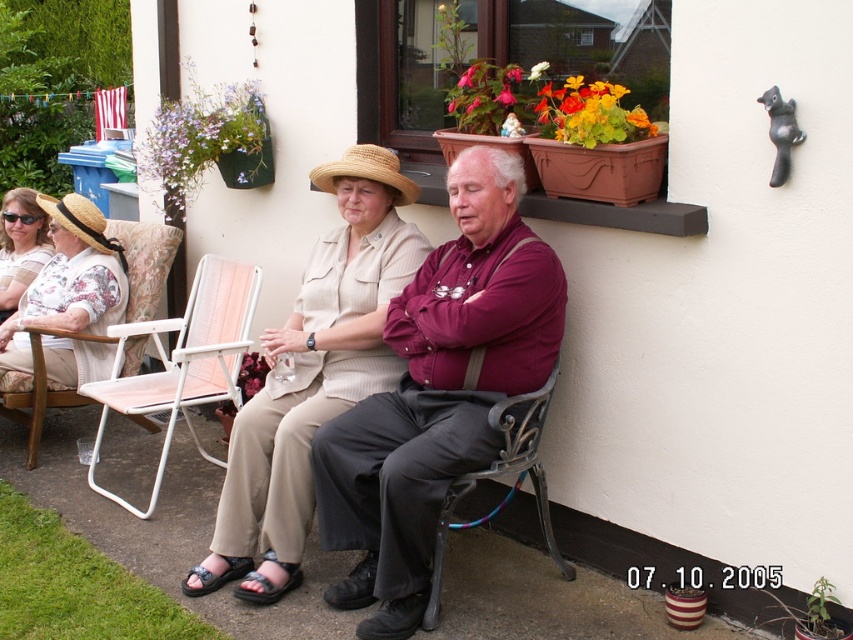
Question: Estimate the real-world distances between objects in this image. Which object is closer to the floral fabric blouse at left?

Choices:
 (A) maroon shirt at center
 (B) white plastic chair at lower left
 (C) beige textured blouse at center
 (D) wooden chair at left

Answer: (D)

Question: Considering the real-world distances, which object is closest to the strawhat at left?

Choices:
 (A) beige textured blouse at center
 (B) wooden chair at left
 (C) metallic black chair at lower center

Answer: (B)

Question: Does floral fabric blouse at left come in front of metallic black chair at lower center?

Choices:
 (A) no
 (B) yes

Answer: (A)

Question: Which object is the farthest from the metallic black chair at lower center?

Choices:
 (A) floral fabric blouse at left
 (B) maroon shirt at center
 (C) matte beige hat at upper left

Answer: (C)

Question: Is white plastic chair at lower left in front of matte beige hat at upper left?

Choices:
 (A) no
 (B) yes

Answer: (B)

Question: Can you confirm if wooden chair at left is wider than strawhat at left?

Choices:
 (A) yes
 (B) no

Answer: (B)